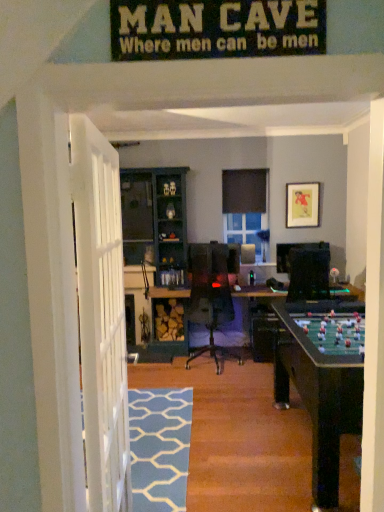
Question: Considering the positions of blue painted wood cabinet at center and green felt table at center in the image, is blue painted wood cabinet at center taller or shorter than green felt table at center?

Choices:
 (A) short
 (B) tall

Answer: (B)

Question: Is blue painted wood cabinet at center situated inside green felt table at center or outside?

Choices:
 (A) inside
 (B) outside

Answer: (B)

Question: Estimate the real-world distances between objects in this image. Which object is farther from the matte paper picture frame at upper right?

Choices:
 (A) blue painted wood cabinet at center
 (B) blue textured rug at lower center
 (C) green felt table at center

Answer: (B)

Question: Estimate the real-world distances between objects in this image. Which object is farther from the blue painted wood cabinet at center?

Choices:
 (A) matte paper picture frame at upper right
 (B) blue textured rug at lower center
 (C) green felt table at center

Answer: (B)